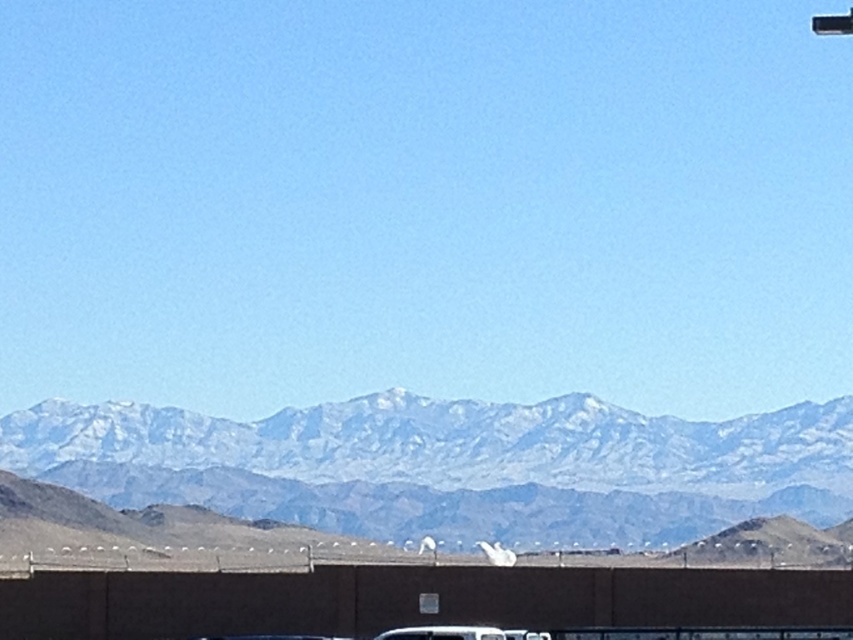
You are standing on the brown concrete overpass at lower center and want to look towards the snowy rocky mountain range at center. In which direction should you turn your head?

The snowy rocky mountain range at center is to the left of brown concrete overpass at lower center, so you should turn your head to the left to look towards it.

You are a photographer planning to capture the snowy rocky mountain range at center and the brown concrete overpass at lower center in a single frame. Given that the mountain range is wider than the overpass, how should you position your camera to ensure both objects are fully visible?

Since the snowy rocky mountain range at center is wider than the brown concrete overpass at lower center, you should position your camera to the side of the narrower overpass to accommodate the wider mountain range in the frame.

You are a photographer planning to capture the snowy rocky mountain range at center and the brown concrete overpass at lower center in a single frame. Given their sizes, which object will occupy more of the photo?

The snowy rocky mountain range at center is larger in size than the brown concrete overpass at lower center, so it will occupy more space in the photo.